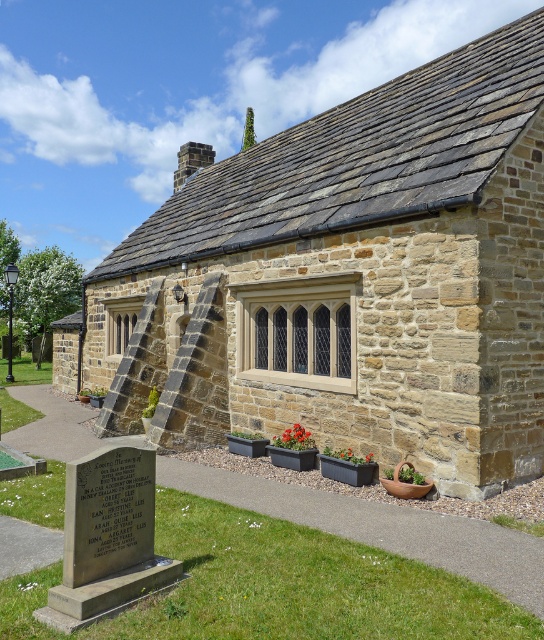
Question: Which point is farther to the camera?

Choices:
 (A) gray stone gravestone at lower left
 (B) stone textured cottage at center

Answer: (B)

Question: Can you confirm if stone textured cottage at center is smaller than gray stone gravestone at lower left?

Choices:
 (A) yes
 (B) no

Answer: (B)

Question: Does stone textured cottage at center lie in front of gray stone gravestone at lower left?

Choices:
 (A) yes
 (B) no

Answer: (B)

Question: Which object is farther from the camera taking this photo?

Choices:
 (A) gray stone gravestone at lower left
 (B) stone textured cottage at center

Answer: (B)

Question: Is stone textured cottage at center above gray stone gravestone at lower left?

Choices:
 (A) no
 (B) yes

Answer: (B)

Question: Which point appears closest to the camera in this image?

Choices:
 (A) (440, 60)
 (B) (126, 468)

Answer: (B)